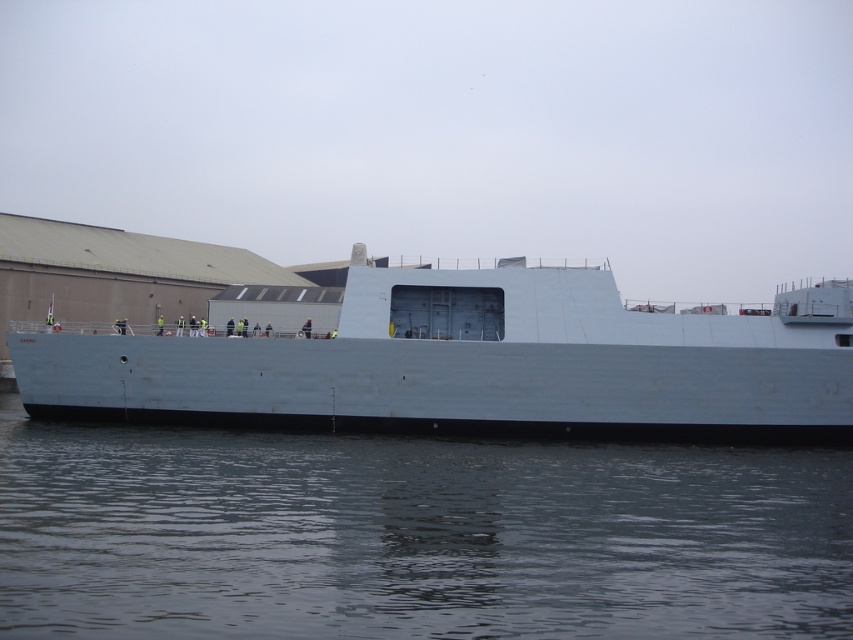
Can you confirm if gray matte water at lower center is positioned below white matte ship at center?

Indeed, gray matte water at lower center is positioned under white matte ship at center.

Is gray matte water at lower center bigger than white matte ship at center?

Actually, gray matte water at lower center might be smaller than white matte ship at center.

In order to click on gray matte water at lower center in this screenshot , I will do [x=413, y=536].